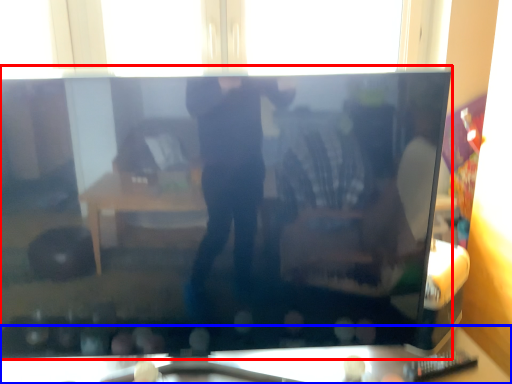
Question: Which of the following is the closest to the observer, television (highlighted by a red box) or furniture (highlighted by a blue box)?

Choices:
 (A) television
 (B) furniture

Answer: (A)